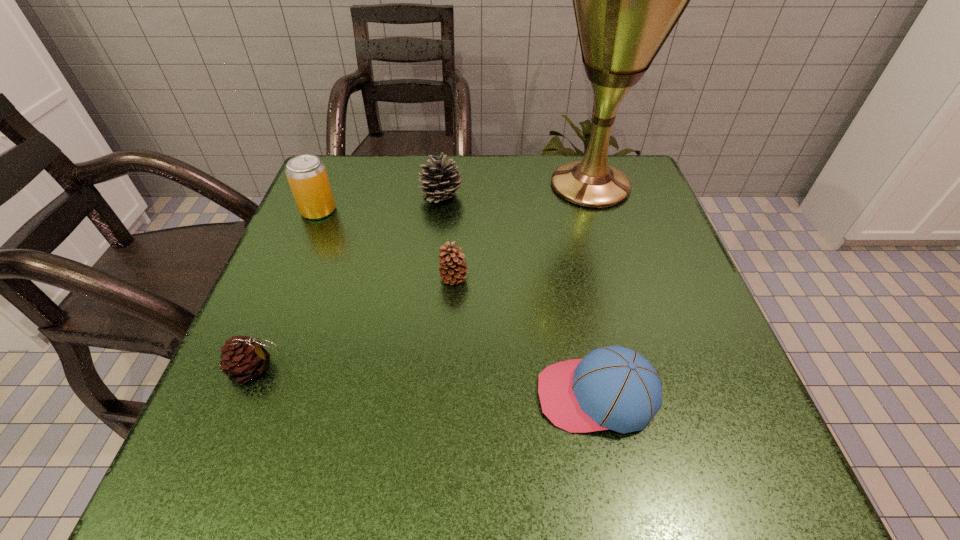
The height and width of the screenshot is (540, 960). I want to click on blank region between the baseball cap and the pop (soda), so click(x=457, y=303).

Locate an element on the screen. empty location between the fourth farthest object and the trophy cup is located at coordinates (522, 231).

Identify the location of blank region between the tallest object and the leftmost pinecone. This screenshot has width=960, height=540. point(422,276).

Identify the location of free spot between the baseball cap and the pop (soda). The image size is (960, 540). (457, 303).

Where is `vacant space in between the tallest pinecone and the third nearest object`? This screenshot has height=540, width=960. vacant space in between the tallest pinecone and the third nearest object is located at coordinates (447, 237).

Locate which object is the second closest to the fourth shortest object. Please provide its 2D coordinates. Your answer should be formatted as a tuple, i.e. [(x, y)], where the tuple contains the x and y coordinates of a point satisfying the conditions above.

[(453, 269)]

Locate which object ranks second in proximity to the leftmost pinecone. Please provide its 2D coordinates. Your answer should be formatted as a tuple, i.e. [(x, y)], where the tuple contains the x and y coordinates of a point satisfying the conditions above.

[(307, 176)]

Locate which pinecone is the closest to the shortest pinecone. Please provide its 2D coordinates. Your answer should be formatted as a tuple, i.e. [(x, y)], where the tuple contains the x and y coordinates of a point satisfying the conditions above.

[(453, 269)]

What are the coordinates of `the second closest pinecone to the leftmost pinecone` in the screenshot? It's located at (x=439, y=181).

The width and height of the screenshot is (960, 540). Find the location of `free location that satisfies the following two spatial constraints: 1. on the front side of the trophy cup; 2. with a leaf charm attached to the nearest pinecone`. free location that satisfies the following two spatial constraints: 1. on the front side of the trophy cup; 2. with a leaf charm attached to the nearest pinecone is located at coordinates (646, 368).